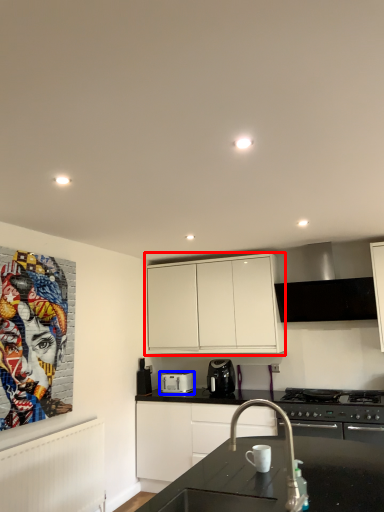
Question: Among these objects, which one is farthest to the camera, cabinetry (highlighted by a red box) or kitchen appliance (highlighted by a blue box)?

Choices:
 (A) cabinetry
 (B) kitchen appliance

Answer: (B)